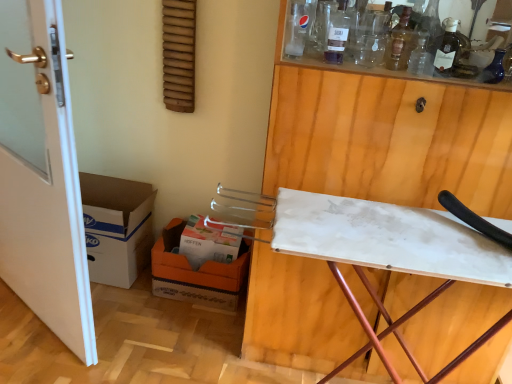
Question: Considering the relative sizes of white marble ironing board at upper right and transparent glass bottle at upper center in the image provided, is white marble ironing board at upper right bigger than transparent glass bottle at upper center?

Choices:
 (A) no
 (B) yes

Answer: (B)

Question: Is white marble ironing board at upper right to the left of transparent glass bottle at upper center from the viewer's perspective?

Choices:
 (A) yes
 (B) no

Answer: (B)

Question: Can you confirm if white marble ironing board at upper right is taller than transparent glass bottle at upper center?

Choices:
 (A) yes
 (B) no

Answer: (A)

Question: From a real-world perspective, is white marble ironing board at upper right over transparent glass bottle at upper center?

Choices:
 (A) yes
 (B) no

Answer: (B)

Question: Would you say transparent glass bottle at upper center is part of white marble ironing board at upper right's contents?

Choices:
 (A) no
 (B) yes

Answer: (B)

Question: From a real-world perspective, is white marble ironing board at upper right physically located above or below orange cardboard box at lower left, which is counted as the first cardboard box, starting from the right?

Choices:
 (A) below
 (B) above

Answer: (B)

Question: From the image's perspective, is white marble ironing board at upper right positioned above or below orange cardboard box at lower left, which is counted as the second cardboard box, starting from the left?

Choices:
 (A) above
 (B) below

Answer: (A)

Question: Is point (434, 364) closer or farther from the camera than point (207, 269)?

Choices:
 (A) closer
 (B) farther

Answer: (A)

Question: Considering their positions, is white marble ironing board at upper right located in front of or behind orange cardboard box at lower left, which is counted as the first cardboard box, starting from the right?

Choices:
 (A) behind
 (B) front

Answer: (B)

Question: From the image's perspective, is translucent glass bottle at upper right, the 2th wine bottle viewed from the right, located above or below white marble ironing board at upper right?

Choices:
 (A) below
 (B) above

Answer: (B)

Question: In the image, is translucent glass bottle at upper right, placed as the 1th wine bottle when sorted from left to right, positioned in front of or behind white marble ironing board at upper right?

Choices:
 (A) front
 (B) behind

Answer: (B)

Question: Is translucent glass bottle at upper right, placed as the 1th wine bottle when sorted from left to right, inside the boundaries of white marble ironing board at upper right, or outside?

Choices:
 (A) outside
 (B) inside

Answer: (B)

Question: Visually, is translucent glass bottle at upper right, the 2th wine bottle viewed from the right, positioned to the left or to the right of white marble ironing board at upper right?

Choices:
 (A) right
 (B) left

Answer: (B)

Question: From a real-world perspective, is white cardboard box at lower center positioned above or below white glossy door at left?

Choices:
 (A) above
 (B) below

Answer: (B)

Question: Is point (215, 258) positioned closer to the camera than point (34, 263)?

Choices:
 (A) farther
 (B) closer

Answer: (A)